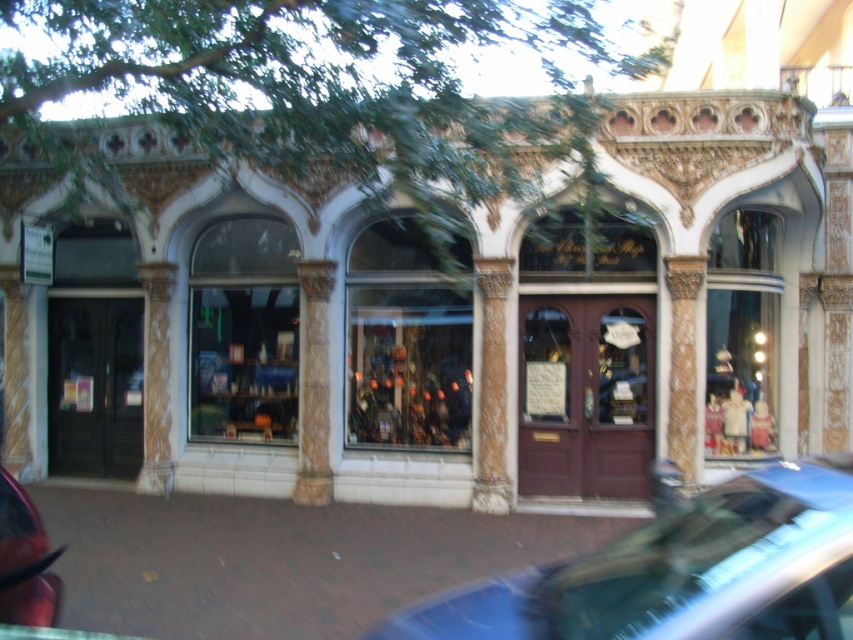
You are a delivery person trying to park your shiny red car at lower left near the building. The space available is exactly the width of the matte glass display case at center. Can your car fit in that space?

The matte glass display case at center is wider than the shiny red car at lower left, so the car can fit in the space since the display case is wider than the car.

You are standing in front of the building and want to park your car. You have two options, the metallic blue car at lower right and the shiny red car at lower left. Which car is positioned closer to the entrance of the building?

The metallic blue car at lower right is closer to the viewer than the shiny red car at lower left, so it is positioned closer to the entrance of the building.

You are a delivery person who needs to park your van 15 feet away from the shiny red car at lower left. Can you park your van near the matte glass display case at center without violating the parking distance rule?

The matte glass display case at center and shiny red car at lower left are 20.52 feet apart from each other. Since the required distance is 15 feet, you can park your van near the matte glass display case at center as it is more than 15 feet away from the shiny red car at lower left.